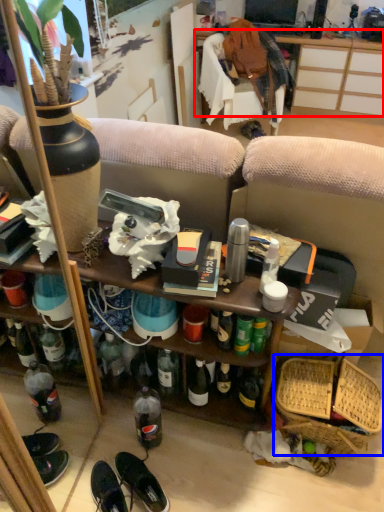
Question: Which object is further to the camera taking this photo, desk (highlighted by a red box) or basket (highlighted by a blue box)?

Choices:
 (A) desk
 (B) basket

Answer: (A)